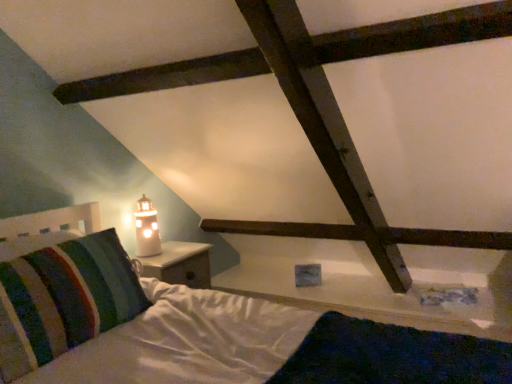
Question: Considering the relative positions of matte glass lighthouse at left and striped fabric pillow at left in the image provided, is matte glass lighthouse at left to the left or to the right of striped fabric pillow at left?

Choices:
 (A) left
 (B) right

Answer: (B)

Question: Considering their positions, is matte glass lighthouse at left located in front of or behind striped fabric pillow at left?

Choices:
 (A) behind
 (B) front

Answer: (A)

Question: Is matte glass lighthouse at left spatially inside striped fabric pillow at left, or outside of it?

Choices:
 (A) inside
 (B) outside

Answer: (B)

Question: Considering the relative positions of striped fabric pillow at left and matte glass lighthouse at left in the image provided, is striped fabric pillow at left to the left or to the right of matte glass lighthouse at left?

Choices:
 (A) right
 (B) left

Answer: (B)

Question: Is striped fabric pillow at left situated inside matte glass lighthouse at left or outside?

Choices:
 (A) inside
 (B) outside

Answer: (B)

Question: In terms of height, does striped fabric pillow at left look taller or shorter compared to matte glass lighthouse at left?

Choices:
 (A) tall
 (B) short

Answer: (A)

Question: From a real-world perspective, is striped fabric pillow at left above or below matte glass lighthouse at left?

Choices:
 (A) below
 (B) above

Answer: (A)